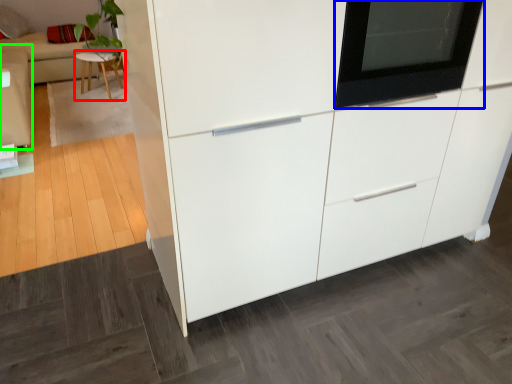
Question: Considering the real-world distances, which object is closest to furniture (highlighted by a red box)? oven (highlighted by a blue box) or couch (highlighted by a green box).

Choices:
 (A) oven
 (B) couch

Answer: (B)